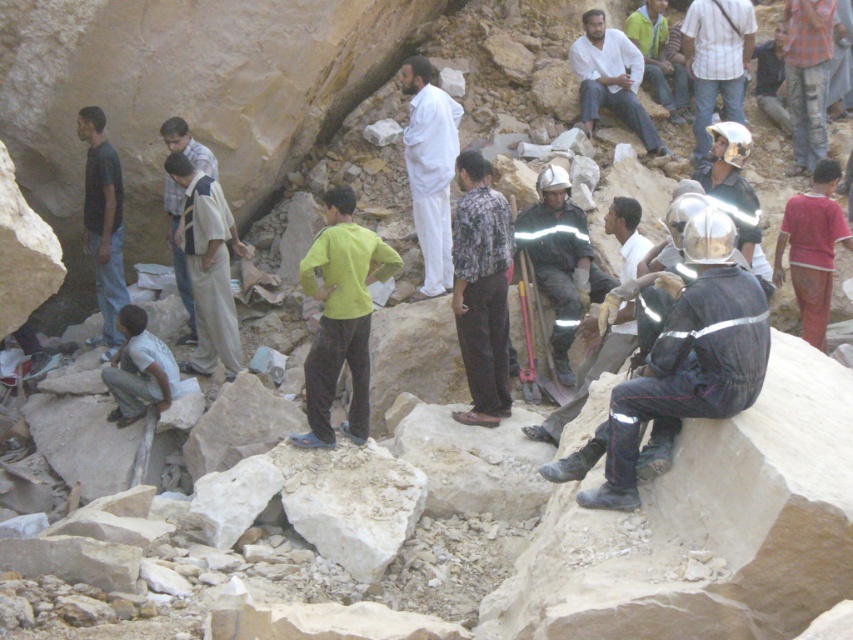
You are a search and rescue team member looking for a missing person in the rocky area. Your GPS device shows a point at coordinates (340, 316). According to the scene, what object is located at that point?

The point at coordinates (340, 316) corresponds to the yellow matte shirt at center.

You are a photographer trying to capture a group photo of the yellow matte shirt at center and the checkered fabric shirt at upper right. Based on their positions, which one would you need to position closer to the camera to ensure both appear the same size in the photo?

The checkered fabric shirt at upper right should be positioned closer to the camera because it is farther away from the camera than the yellow matte shirt at center, so moving it closer would balance their sizes in the photo.

In the scene shown: You are a member of the rescue team looking for a missing person. You notice two individuals in the area wearing a dark blue shirt at left and a checkered fabric shirt at upper right. Which person is closer to you, the rescuer?

A: The dark blue shirt at left is closer to you because it is in front of the checkered fabric shirt at upper right.